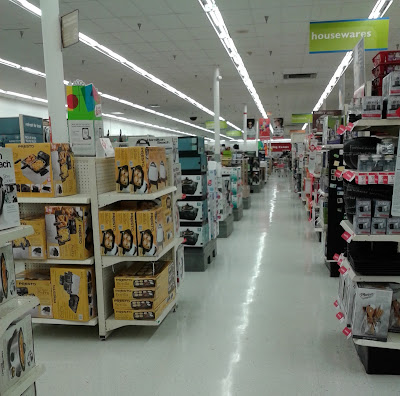
Find the location of a particular element. The image size is (400, 396). blue partition is located at coordinates 11,125.